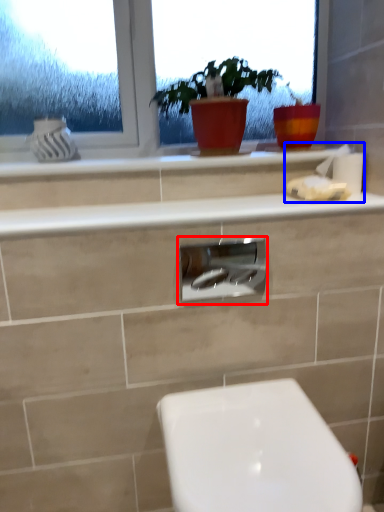
Question: Among these objects, which one is farthest to the camera, cabinet (highlighted by a red box) or tissue (highlighted by a blue box)?

Choices:
 (A) cabinet
 (B) tissue

Answer: (B)